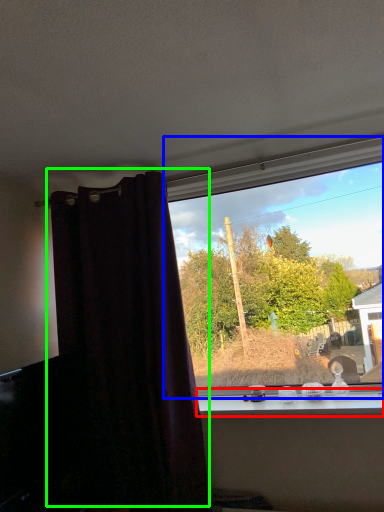
Question: Based on their relative distances, which object is nearer to window sill (highlighted by a red box)? Choose from window (highlighted by a blue box) and curtain (highlighted by a green box).

Choices:
 (A) window
 (B) curtain

Answer: (B)